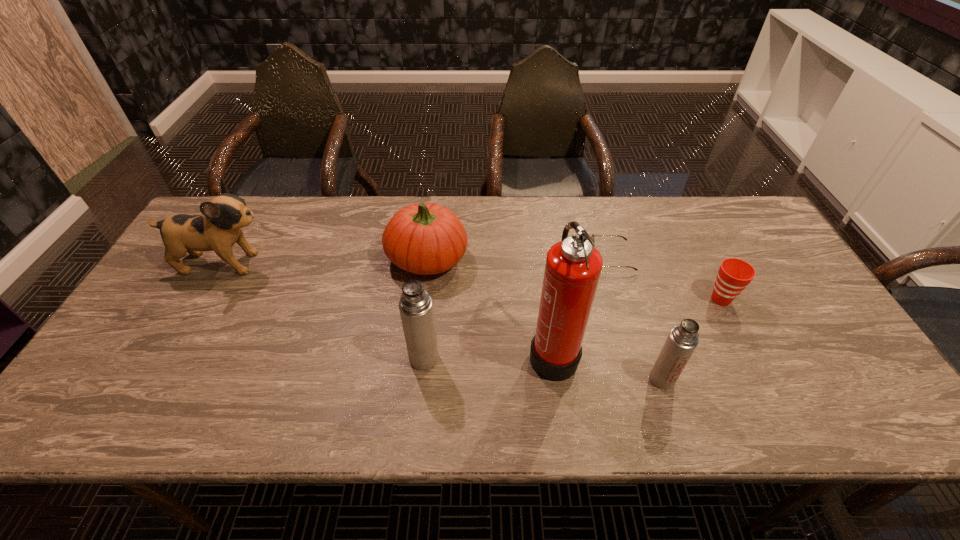
Find the location of a particular element. The height and width of the screenshot is (540, 960). vacant space that satisfies the following two spatial constraints: 1. on the front-facing side of the fourth object from left to right; 2. on the front side of the taller thermos bottle is located at coordinates (553, 357).

This screenshot has height=540, width=960. I want to click on vacant space that satisfies the following two spatial constraints: 1. on the front-facing side of the shorter thermos bottle; 2. on the left side of the tallest object, so click(556, 379).